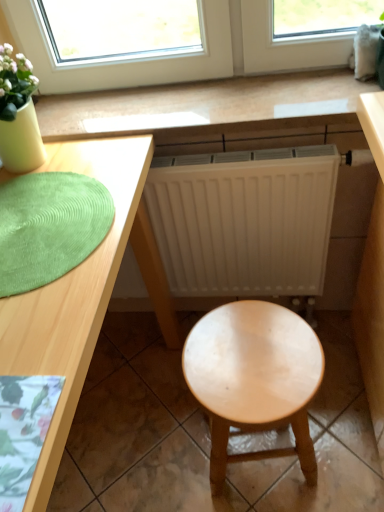
Question: From a real-world perspective, relative to light brown wood stool at center, is green textured mat at left vertically above or below?

Choices:
 (A) below
 (B) above

Answer: (B)

Question: From the image's perspective, is green textured mat at left above or below light brown wood stool at center?

Choices:
 (A) below
 (B) above

Answer: (B)

Question: Which object is the farthest from the wooden table at center?

Choices:
 (A) green textured mat at left
 (B) light brown wood stool at center
 (C) light wood desk at center

Answer: (B)

Question: Which is nearer to the light brown wood stool at center?

Choices:
 (A) wooden table at center
 (B) green textured mat at left
 (C) light wood desk at center

Answer: (C)